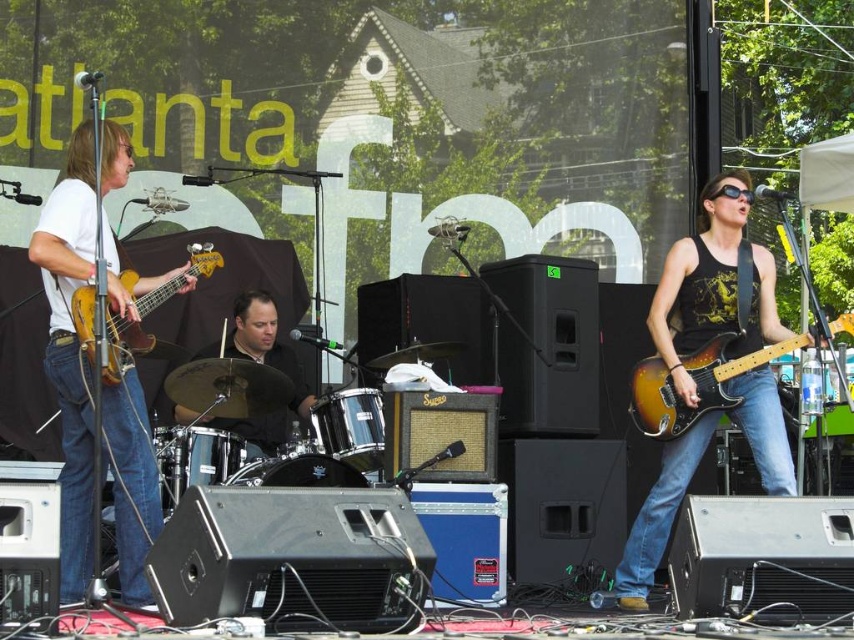
You are a stagehand at the Atlanta festival. You need to move a tall ladder that is 2 meters high through the space between the satin black guitar at center and the black leather drum set at center. Can the ladder fit vertically between them without hitting either?

The satin black guitar at center is taller than the black leather drum set at center. Since the ladder is 2 meters high, it can only fit if the shorter object is at least 2 meters tall. However, since the guitar is taller than the drum set, the drum set must be shorter than the guitar. Without knowing the exact height of the drum set, we cannot confirm if the ladder will fit. More information is needed.

You are a photographer standing at the center of the stage. You want to take a photo that includes both the point at (705, 353) and the point at (241, 355). Which point should you focus on first to ensure both are in the frame?

You should focus on the point at (705, 353) first because it is in front of the point at (241, 355), ensuring both are within the camera frame.

You are standing at the front of the stage at an outdoor music festival in Atlanta. You see the satin black guitar at center. Can you comfortably reach out and touch it without moving from your current position?

The satin black guitar at center is 6.01 meters away from the viewer. Since this distance is greater than an average person arm length, you cannot comfortably reach out and touch it without moving from your current position.